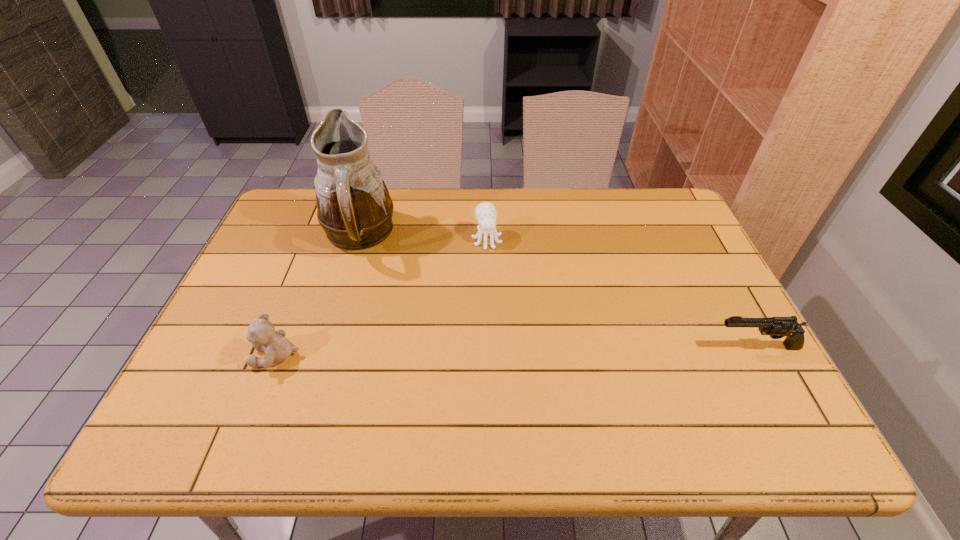
This screenshot has width=960, height=540. I want to click on teddy bear, so pos(262,334).

Identify the location of gun. (777, 327).

You are a GUI agent. You are given a task and a screenshot of the screen. Output one action in this format:
    pyautogui.click(x=<x>, y=<y>)
    Task: Click on the second object from right to left
    The width and height of the screenshot is (960, 540).
    Given the screenshot: What is the action you would take?
    pyautogui.click(x=485, y=212)

This screenshot has width=960, height=540. I want to click on pitcher, so [354, 208].

I want to click on vacant region located on the face of the teddy bear, so click(x=223, y=356).

In order to click on free space located 0.100m on the face of the teddy bear in this screenshot , I will do `click(210, 356)`.

Where is `free spot located on the face of the teddy bear`? Image resolution: width=960 pixels, height=540 pixels. free spot located on the face of the teddy bear is located at coordinates (210, 356).

The width and height of the screenshot is (960, 540). What are the coordinates of `free region located at the end of the barrel of the rightmost object` in the screenshot? It's located at (659, 347).

Identify the location of free location located at the end of the barrel of the rightmost object. Image resolution: width=960 pixels, height=540 pixels. (588, 347).

Find the location of a particular element. The width and height of the screenshot is (960, 540). vacant space situated at the end of the barrel of the rightmost object is located at coordinates (588, 347).